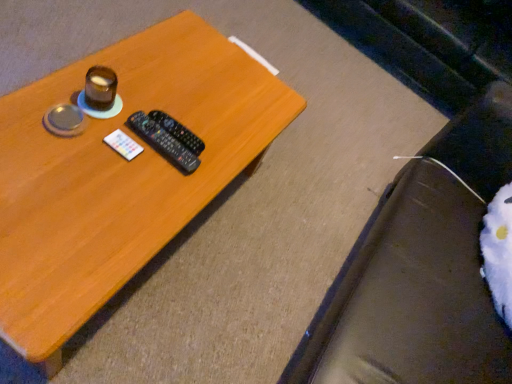
The height and width of the screenshot is (384, 512). In order to click on unoccupied region to the right of black plastic remote control at center, placed as the second remote control when sorted from front to back in this screenshot , I will do `click(214, 156)`.